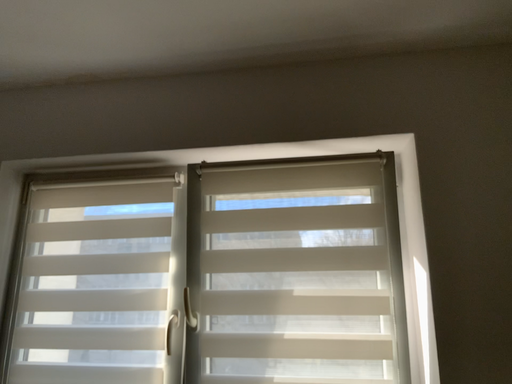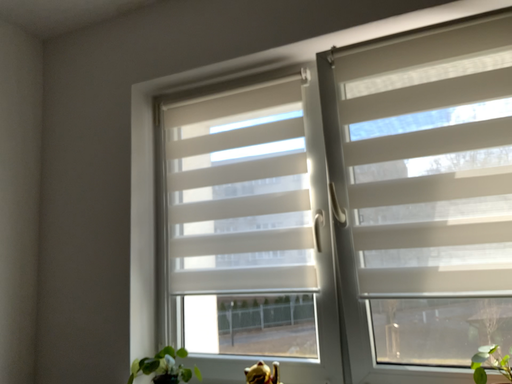
Question: How did the camera likely rotate when shooting the video?

Choices:
 (A) rotated right
 (B) rotated left

Answer: (B)